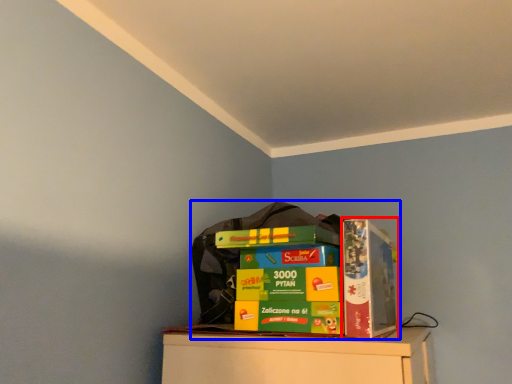
Question: Which of the following is the farthest to the observer, paperback book (highlighted by a red box) or collection (highlighted by a blue box)?

Choices:
 (A) paperback book
 (B) collection

Answer: (A)